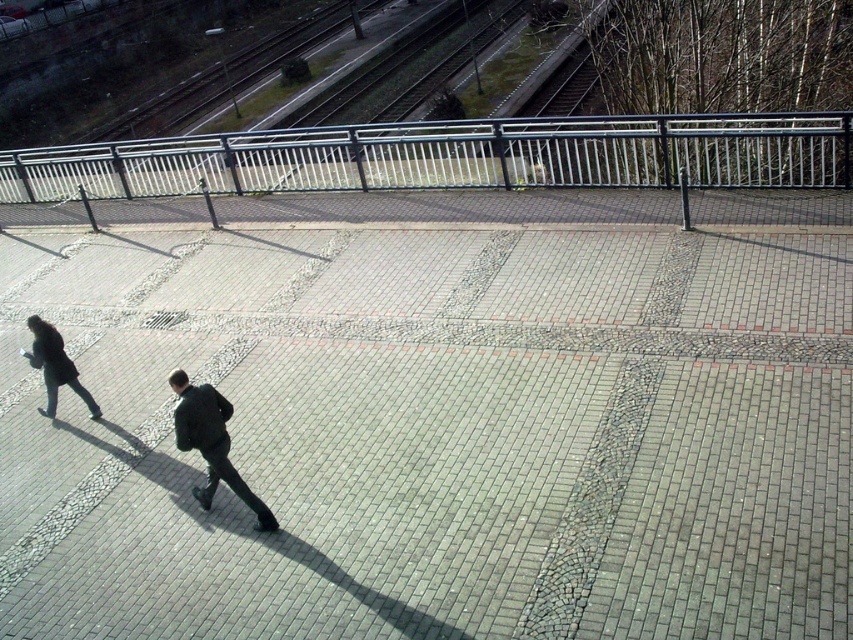
Does point (641, 628) come in front of point (294, 211)?

That is True.

Who is taller, gray brick pavement at center or metallic silver fence at upper center?

metallic silver fence at upper center is taller.

Who is more forward, (341, 433) or (227, 176)?

Point (341, 433) is more forward.

You are a GUI agent. You are given a task and a screenshot of the screen. Output one action in this format:
    pyautogui.click(x=<x>, y=<y>)
    Task: Click on the gray brick pavement at center
    
    Given the screenshot: What is the action you would take?
    pyautogui.click(x=436, y=435)

Who is lower down, dark green jacket at center or dark gray coat at lower left?

Positioned lower is dark green jacket at center.

Between point (256, 497) and point (44, 324), which one is positioned behind?

Positioned behind is point (44, 324).

At what (x,y) coordinates should I click in order to perform the action: click on dark green jacket at center. Please return your answer as a coordinate pair (x, y). This screenshot has height=640, width=853. Looking at the image, I should click on (212, 442).

Does metallic silver fence at upper center have a lesser height compared to dark gray coat at lower left?

Incorrect, metallic silver fence at upper center's height does not fall short of dark gray coat at lower left's.

Is point (816, 168) in front of point (30, 330)?

That is False.

Locate an element on the screen. metallic silver fence at upper center is located at coordinates (445, 157).